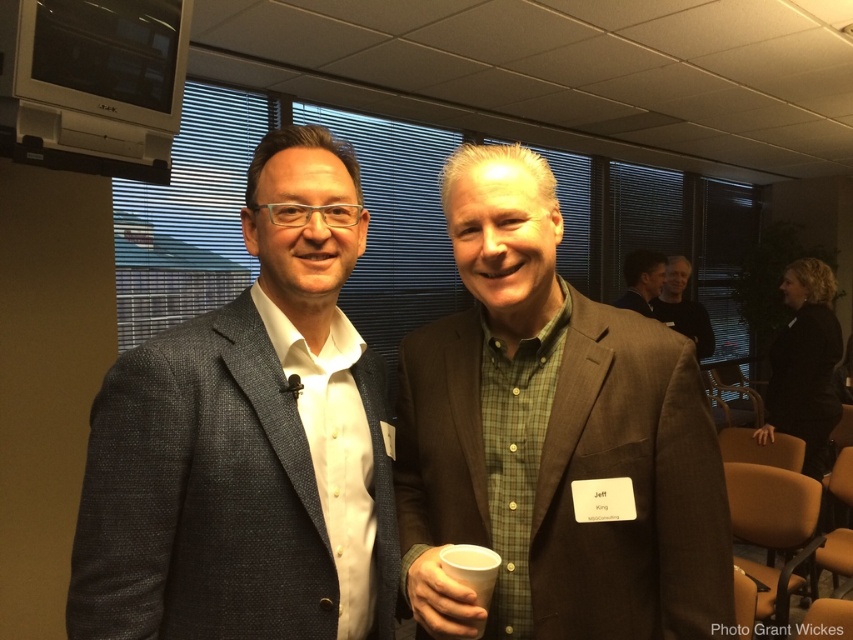
You are organizing a small event and need to place a new name tag holder that is 15 cm wide on the table. The white paper cup at center and dark brown leather jacket at upper right are already on the table. Can the name tag holder fit between them?

The white paper cup at center is smaller than the dark brown leather jacket at upper right. Since the name tag holder is 15 cm wide, it depends on the available space between them. However, without knowing the exact distance between the two objects, we cannot confirm if there is enough space. Please measure the gap between the white paper cup at center and the dark brown leather jacket at upper right first.

You are organizing a conference and need to place a name tag on the white paper cup at center and the dark brown leather jacket at upper right. Which object requires a larger name tag to fit properly?

The dark brown leather jacket at upper right requires a larger name tag because it has a greater width than the white paper cup at center.